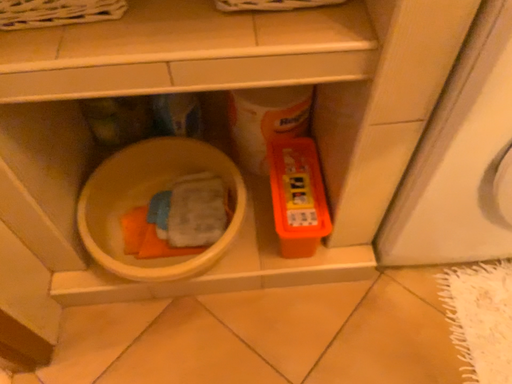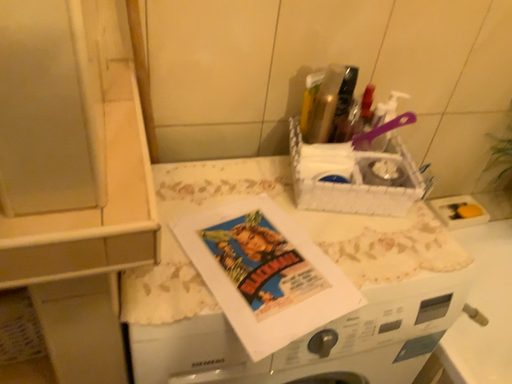
Question: Which way did the camera rotate in the video?

Choices:
 (A) rotated right
 (B) rotated left

Answer: (A)